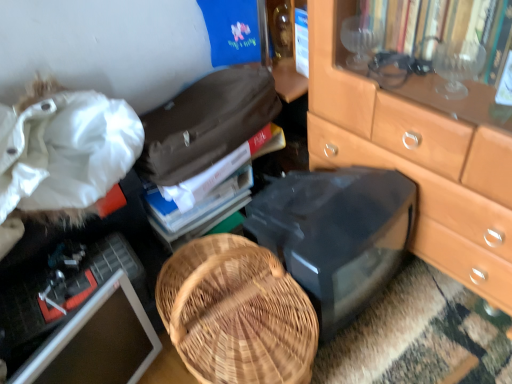
Question: Looking at their shapes, would you say hardcover book at center is wider or thinner than matte black computer monitor at lower left?

Choices:
 (A) wide
 (B) thin

Answer: (A)

Question: Is hardcover book at center taller or shorter than matte black computer monitor at lower left?

Choices:
 (A) tall
 (B) short

Answer: (B)

Question: Estimate the real-world distances between objects in this image. Which object is farther from the hardcover book at center?

Choices:
 (A) matte black computer monitor at lower left
 (B) white fabric at upper left
 (C) black plastic desktop at center

Answer: (A)

Question: Which of these objects is positioned closest to the white fabric at upper left?

Choices:
 (A) black plastic desktop at center
 (B) hardcover book at center
 (C) matte black computer monitor at lower left

Answer: (B)